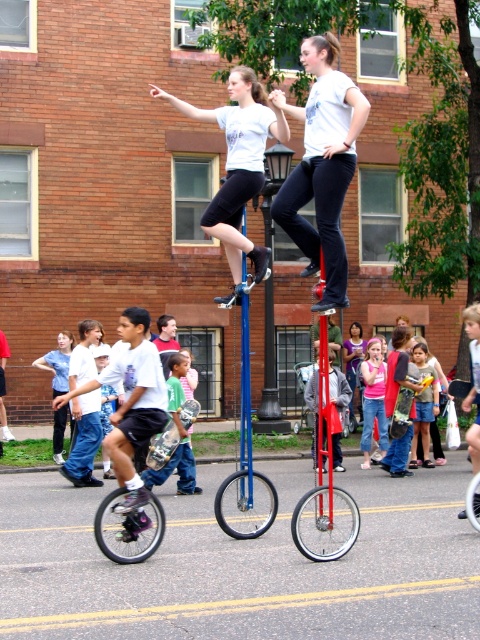
You are a street performer who wants to choose between the shiny metallic unicycle at lower left and the brushed metal skateboard at lower left for a tightrope walk. Which object is wider and thus more stable for balancing?

The shiny metallic unicycle at lower left is wider than the brushed metal skateboard at lower left, so it would be more stable for balancing during a tightrope walk.